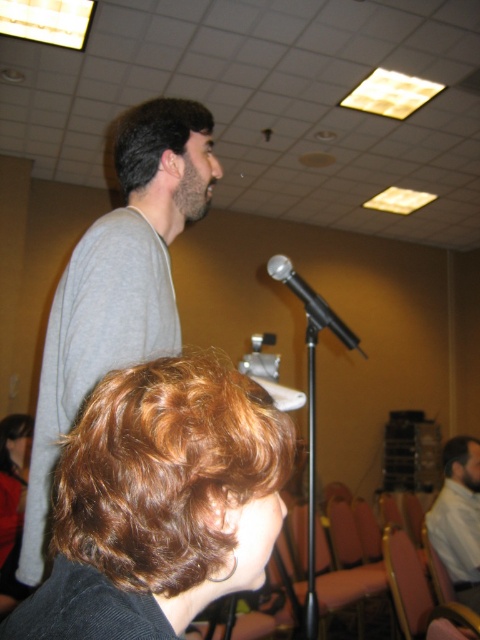
Identify the location of gray matte sweater at upper left. The height and width of the screenshot is (640, 480). (118, 285).

Is point (140, 317) behind point (475, 500)?

No, (140, 317) is in front of (475, 500).

Identify the location of gray matte sweater at upper left. (118, 285).

Is point (472, 548) in front of point (193, 112)?

No, (472, 548) is behind (193, 112).

What do you see at coordinates (458, 518) in the screenshot? The width and height of the screenshot is (480, 640). I see `light blue shirt at center` at bounding box center [458, 518].

Is point (458, 509) in front of point (180, 125)?

No.

I want to click on light blue shirt at center, so click(458, 518).

Which is behind, point (173, 589) or point (201, 115)?

The point (201, 115) is more distant.

Does brown curly hair at lower left have a lesser width compared to dark brown hair at upper left?

In fact, brown curly hair at lower left might be wider than dark brown hair at upper left.

Between point (191, 508) and point (184, 104), which one is positioned in front?

Positioned in front is point (191, 508).

The height and width of the screenshot is (640, 480). I want to click on brown curly hair at lower left, so click(x=167, y=472).